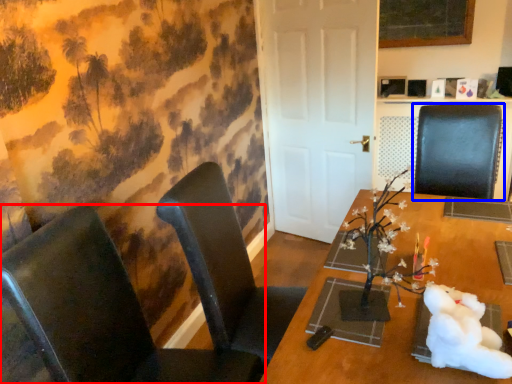
Question: Which object is further to the camera taking this photo, chair (highlighted by a red box) or chair (highlighted by a blue box)?

Choices:
 (A) chair
 (B) chair

Answer: (B)